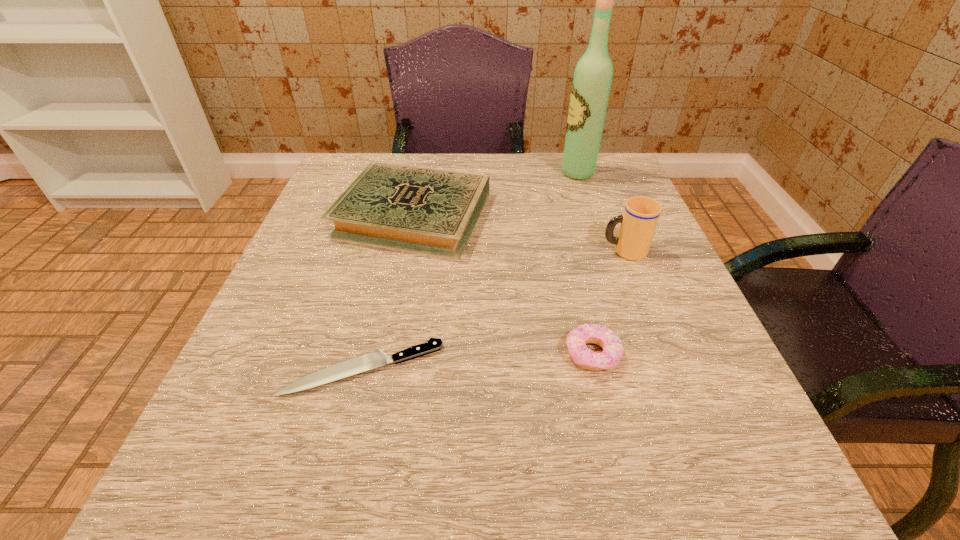
Select which object appears as the second closest to the second tallest object. Please provide its 2D coordinates. Your answer should be formatted as a tuple, i.e. [(x, y)], where the tuple contains the x and y coordinates of a point satisfying the conditions above.

[(430, 211)]

The height and width of the screenshot is (540, 960). I want to click on vacant region that satisfies the following two spatial constraints: 1. on the front-facing side of the wine bottle; 2. on the side of the cup with the handle, so click(604, 251).

You are a GUI agent. You are given a task and a screenshot of the screen. Output one action in this format:
    pyautogui.click(x=<x>, y=<y>)
    Task: Click on the vacant position in the image that satisfies the following two spatial constraints: 1. on the front-facing side of the tallest object; 2. on the side of the cup with the handle
    Image resolution: width=960 pixels, height=540 pixels.
    Given the screenshot: What is the action you would take?
    pyautogui.click(x=604, y=251)

The image size is (960, 540). I want to click on free space that satisfies the following two spatial constraints: 1. on the front side of the third tallest object; 2. on the side of the fourth shortest object with the handle, so click(x=405, y=251).

Locate an element on the screen. vacant space that satisfies the following two spatial constraints: 1. on the side of the cup with the handle; 2. on the front-facing side of the tallest object is located at coordinates (593, 173).

Where is `vacant region that satisfies the following two spatial constraints: 1. on the front side of the third tallest object; 2. on the side of the cup with the handle`? vacant region that satisfies the following two spatial constraints: 1. on the front side of the third tallest object; 2. on the side of the cup with the handle is located at coordinates (405, 251).

What are the coordinates of `vacant space that satisfies the following two spatial constraints: 1. on the side of the cup with the handle; 2. on the front side of the third tallest object` in the screenshot? It's located at (610, 215).